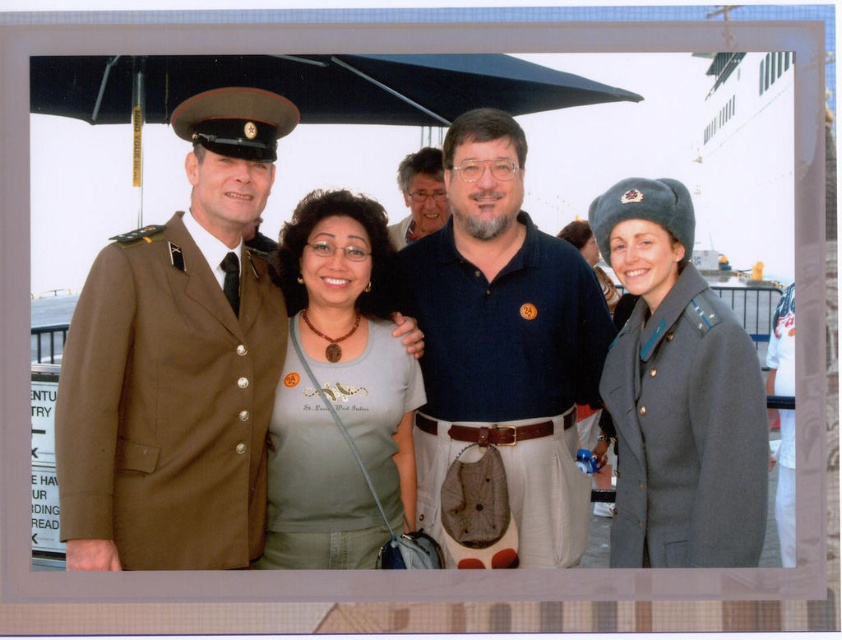
You are a photographer trying to capture a clear shot of the matte brown uniform at left and the matte black shirt at center. Since you want both subjects to be in focus, which one should you focus on first?

The matte brown uniform at left is in front of the matte black shirt at center, so you should focus on the matte brown uniform at left first to ensure both are in focus.

You are standing at the point marked as point [417,305]. You want to walk towards the large white ship in the background. Is the railing or barrier between you and the ship in your way?

The point [417,305] is 207.79 feet away from the viewer. Since the railing or barrier is in front of the group, it would be between the point and the ship, obstructing the path.